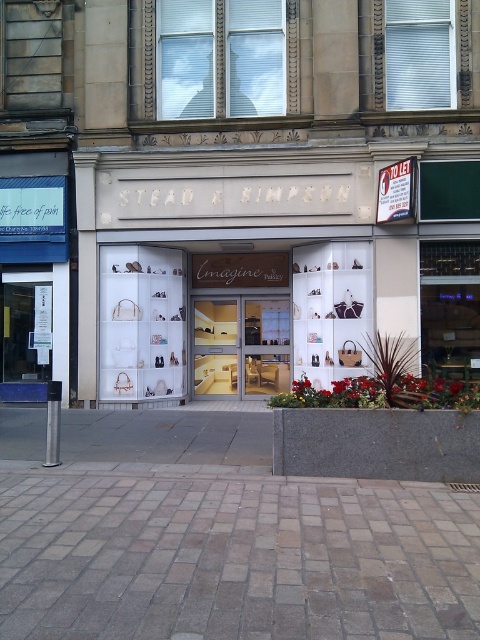
Is point (201, 349) more distant than point (264, 68)?

That is True.

Is white leather handbags at center below matte glass window at upper center?

Yes.

Between point (297, 250) and point (277, 104), which one is positioned behind?

Positioned behind is point (297, 250).

Where is `white leather handbags at center`? The height and width of the screenshot is (640, 480). white leather handbags at center is located at coordinates (229, 321).

Which is behind, point (76, 499) or point (195, 316)?

Positioned behind is point (195, 316).

Can you confirm if brown brick pavement at lower center is positioned below white leather handbags at center?

Yes, brown brick pavement at lower center is below white leather handbags at center.

Between point (151, 476) and point (259, 340), which one is positioned in front?

Point (151, 476)

At what (x,y) coordinates should I click in order to perform the action: click on brown brick pavement at lower center. Please return your answer as a coordinate pair (x, y). Looking at the image, I should click on pos(236,557).

Does matte glass window at upper center lie in front of matte white display case at center?

Yes.

Is matte glass window at upper center behind matte white display case at center?

No, it is in front of matte white display case at center.

Between point (171, 113) and point (215, 326), which one is positioned in front?

Point (171, 113) is more forward.

Identify the location of matte glass window at upper center. The width and height of the screenshot is (480, 640). (187, 58).